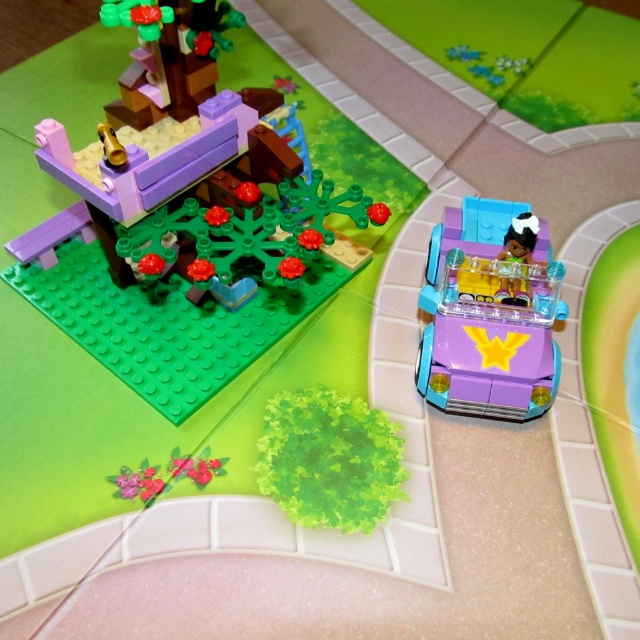
Is point (88, 332) closer to camera compared to point (467, 380)?

No.

The height and width of the screenshot is (640, 640). Describe the element at coordinates (188, 300) in the screenshot. I see `purple glossy car at upper right` at that location.

Where is `purple glossy car at upper right`? This screenshot has width=640, height=640. purple glossy car at upper right is located at coordinates (188, 300).

Identify the location of purple glossy car at upper right. This screenshot has height=640, width=640. (188, 300).